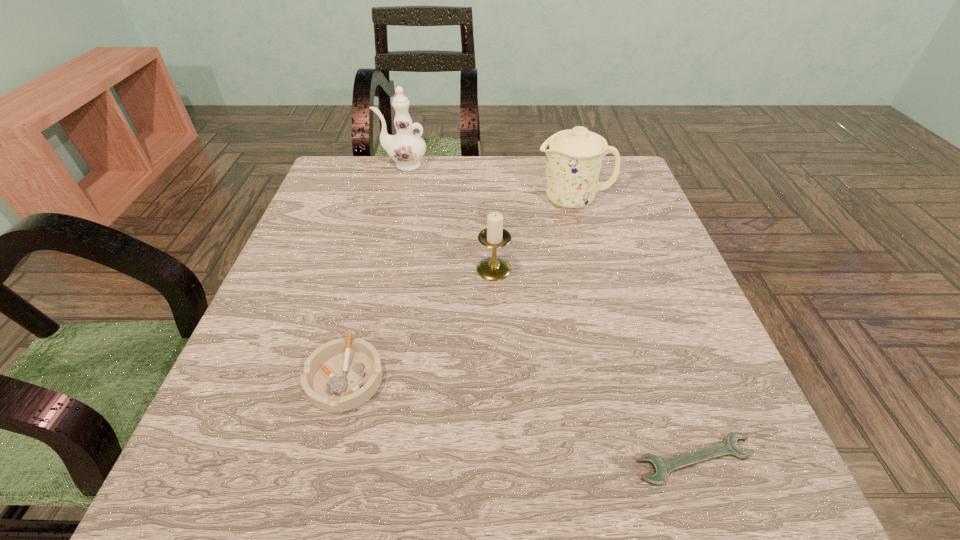
At what (x,y) coordinates should I click in order to perform the action: click on free space located 0.120m at the spout of the farther chinaware. Please return your answer as a coordinate pair (x, y). This screenshot has width=960, height=540. Looking at the image, I should click on (336, 165).

Where is `free location located 0.130m at the spout of the farther chinaware`? Image resolution: width=960 pixels, height=540 pixels. free location located 0.130m at the spout of the farther chinaware is located at coordinates (332, 165).

Where is `vacant space located at the spout of the farther chinaware`? vacant space located at the spout of the farther chinaware is located at coordinates pos(336,165).

Locate an element on the screen. vacant space located on the spout of the right chinaware is located at coordinates (471, 200).

You are a GUI agent. You are given a task and a screenshot of the screen. Output one action in this format:
    pyautogui.click(x=<x>, y=<y>)
    Task: Click on the free region located on the spout of the right chinaware
    This screenshot has width=960, height=540.
    Given the screenshot: What is the action you would take?
    pyautogui.click(x=503, y=200)

Locate an element on the screen. The width and height of the screenshot is (960, 540). vacant space positioned on the spout of the right chinaware is located at coordinates (420, 200).

The height and width of the screenshot is (540, 960). I want to click on vacant region located on the right of the third tallest object, so click(579, 269).

The width and height of the screenshot is (960, 540). In order to click on vacant space located 0.230m on the right of the fourth tallest object in this screenshot , I will do `click(521, 377)`.

Find the location of a particular element. The height and width of the screenshot is (540, 960). vacant position located 0.280m on the back of the wrench is located at coordinates pos(638,299).

Locate an element on the screen. object located at the near edge is located at coordinates (662, 467).